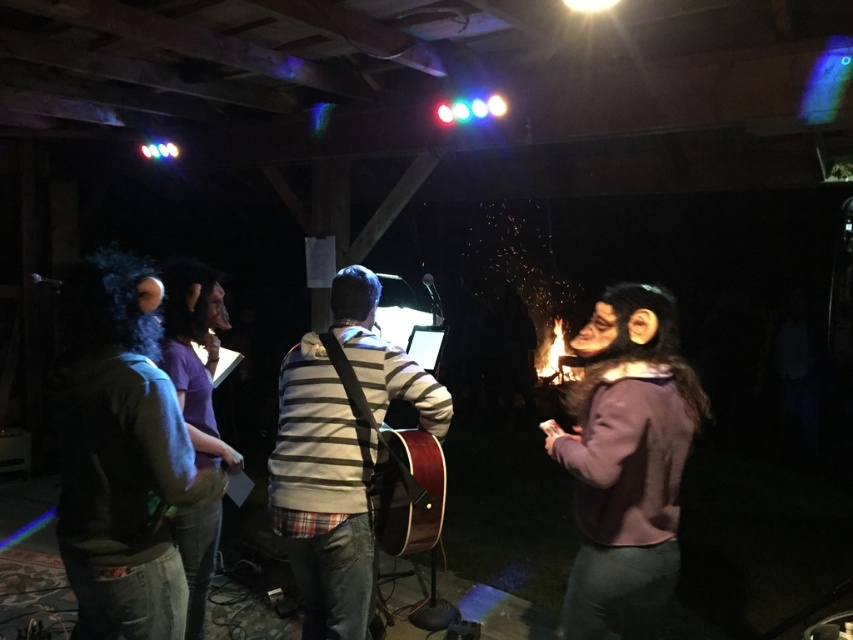
Question: Does purple fleece sweater at right appear on the right side of striped sweater at center?

Choices:
 (A) no
 (B) yes

Answer: (B)

Question: Does purple fleece sweater at right have a lesser width compared to striped sweater at center?

Choices:
 (A) yes
 (B) no

Answer: (A)

Question: Which point is farther to the camera?

Choices:
 (A) (434, 500)
 (B) (619, 576)

Answer: (A)

Question: Which point appears closest to the camera in this image?

Choices:
 (A) (415, 465)
 (B) (282, 497)

Answer: (B)

Question: Among these points, which one is nearest to the camera?

Choices:
 (A) pos(577,346)
 (B) pos(282,502)

Answer: (B)

Question: Is purple fleece sweater at right positioned at the back of striped sweater at center?

Choices:
 (A) no
 (B) yes

Answer: (A)